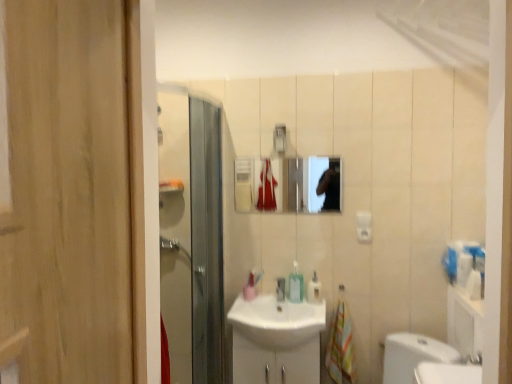
Question: From a real-world perspective, is multicolored fabric hand towel at lower right above or below white glossy sink at center?

Choices:
 (A) above
 (B) below

Answer: (A)

Question: Looking at their shapes, would you say multicolored fabric hand towel at lower right is wider or thinner than white glossy sink at center?

Choices:
 (A) wide
 (B) thin

Answer: (B)

Question: Which is farther from the translucent plastic soap dispenser at center, which appears as the second soap dispenser when viewed from the right?

Choices:
 (A) white glossy sink at center
 (B) white glossy sink at center
 (C) multicolored fabric hand towel at lower right
 (D) matte glass mirror at upper center
 (E) translucent plastic soap dispenser at center, positioned as the 1th soap dispenser in right-to-left order

Answer: (D)

Question: Estimate the real-world distances between objects in this image. Which object is farther from the translucent plastic soap dispenser at center, the second soap dispenser viewed from the left?

Choices:
 (A) matte silver faucet at sink center
 (B) translucent plastic soap dispenser at center, which appears as the second soap dispenser when viewed from the right
 (C) multicolored fabric hand towel at lower right
 (D) white glossy sink at center
 (E) white glossy sink at center

Answer: (D)